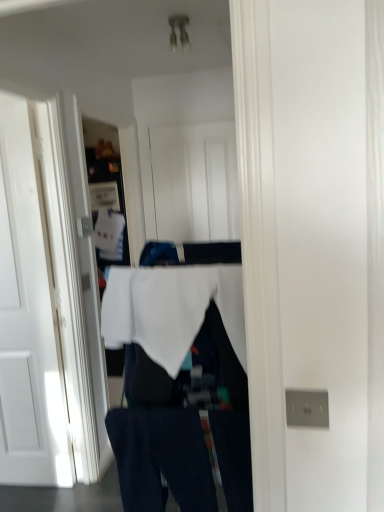
Question: Is dark blue denim jeans at lower center inside or outside of white wood door at center, the first door in the right-to-left sequence?

Choices:
 (A) outside
 (B) inside

Answer: (A)

Question: In terms of size, does dark blue denim jeans at lower center appear bigger or smaller than white wood door at center, the first door in the right-to-left sequence?

Choices:
 (A) big
 (B) small

Answer: (B)

Question: Which object is positioned farthest from the dark blue denim jeans at lower center?

Choices:
 (A) white fabric at center
 (B) white fabric at center
 (C) white matte door at left, the first door positioned from the left
 (D) white wood door at center, the first door in the right-to-left sequence

Answer: (D)

Question: Which object is positioned closest to the white wood door at center, the first door in the right-to-left sequence?

Choices:
 (A) white fabric at center
 (B) dark blue denim jeans at lower center
 (C) white fabric at center
 (D) white matte door at left, the first door positioned from the left

Answer: (D)